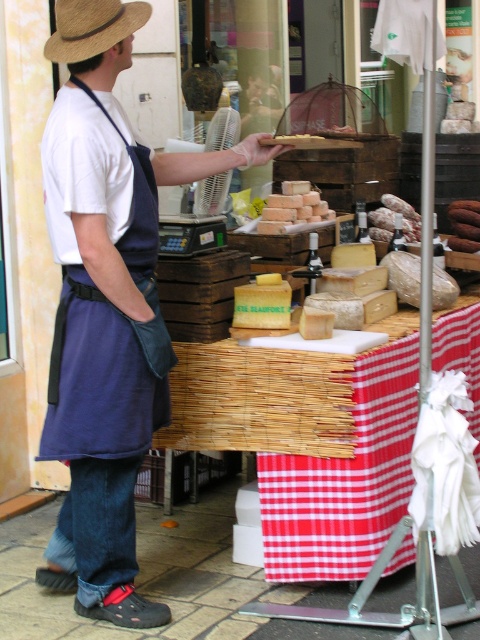
Question: Is blue fabric apron at left wider than straw hat at upper left?

Choices:
 (A) no
 (B) yes

Answer: (B)

Question: Is red checkered tablecloth at center positioned behind semi-translucent plastic baguette at center?

Choices:
 (A) yes
 (B) no

Answer: (B)

Question: Among these objects, which one is nearest to the camera?

Choices:
 (A) smooth brown bread at center
 (B) smooth yellow cheese at center
 (C) blue fabric apron at left

Answer: (C)

Question: Does blue fabric apron at left come in front of straw hat at upper left?

Choices:
 (A) no
 (B) yes

Answer: (B)

Question: Which object appears farthest from the camera in this image?

Choices:
 (A) straw hat at upper left
 (B) blue fabric apron at left
 (C) smooth brown bread at center

Answer: (C)

Question: Which of the following is the farthest from the observer?

Choices:
 (A) (305, 458)
 (B) (121, 29)

Answer: (A)